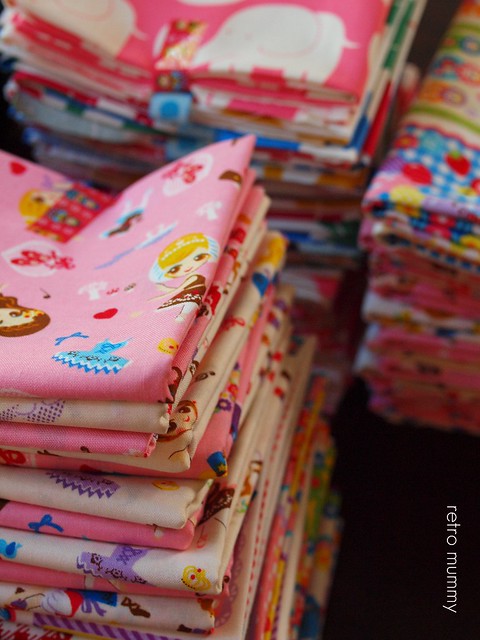
You are a GUI agent. You are given a task and a screenshot of the screen. Output one action in this format:
    pyautogui.click(x=<x>, y=<y>)
    Task: Click on the stacks of fabric
    
    Given the screenshot: What is the action you would take?
    [312, 192], [406, 255], [192, 516]